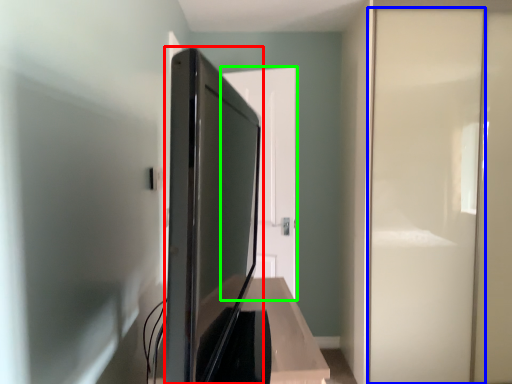
Question: Which object is the closest to the appliance (highlighted by a red box)? Choose among these: screen door (highlighted by a blue box) or door (highlighted by a green box).

Choices:
 (A) screen door
 (B) door

Answer: (B)